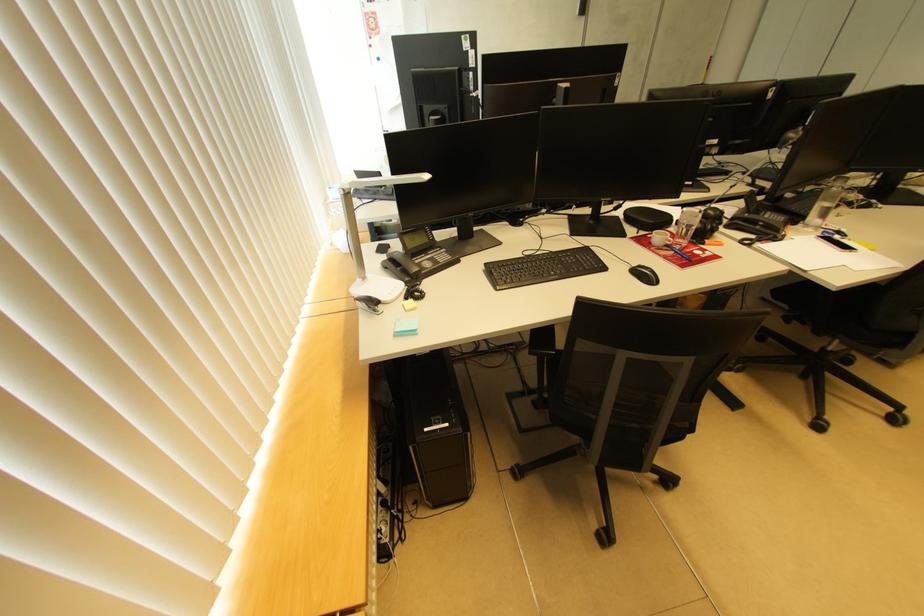
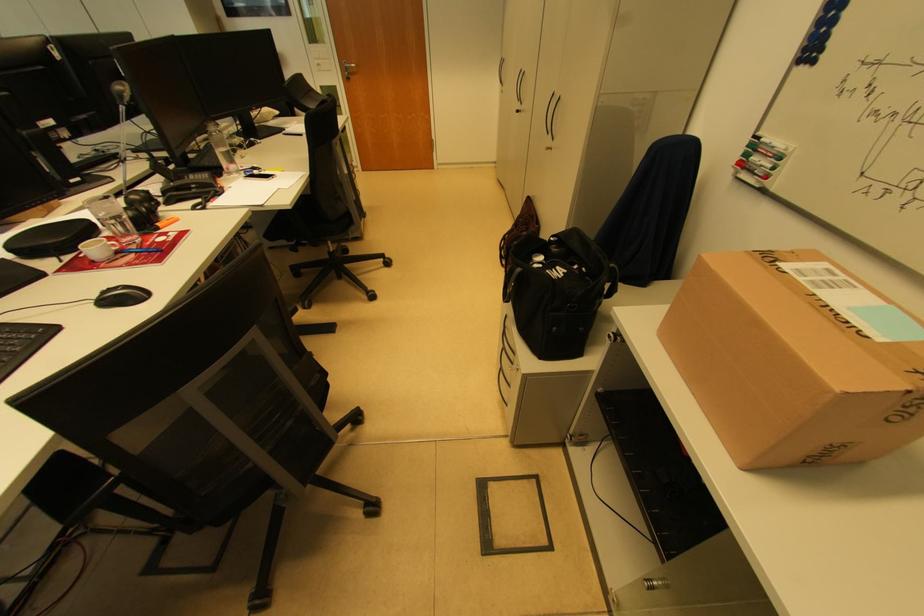
Question: I am providing you with two images of the same scene from different viewpoints. After the viewpoint changes to image2, which objects are now occluded?

Choices:
 (A) blue pen
 (B) orange highlighter
 (C) green bottle cap
 (D) black cabinet handle

Answer: (B)